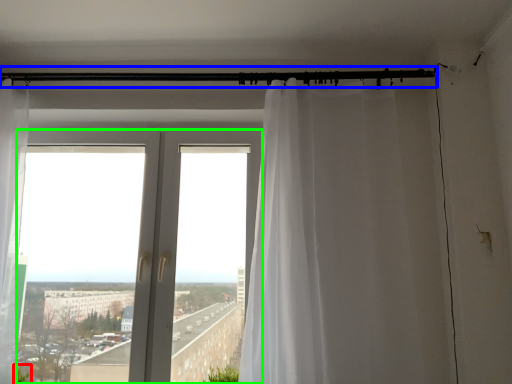
Question: Estimate the real-world distances between objects in this image. Which object is closer to plant (highlighted by a red box), beam (highlighted by a blue box) or window (highlighted by a green box)?

Choices:
 (A) beam
 (B) window

Answer: (B)